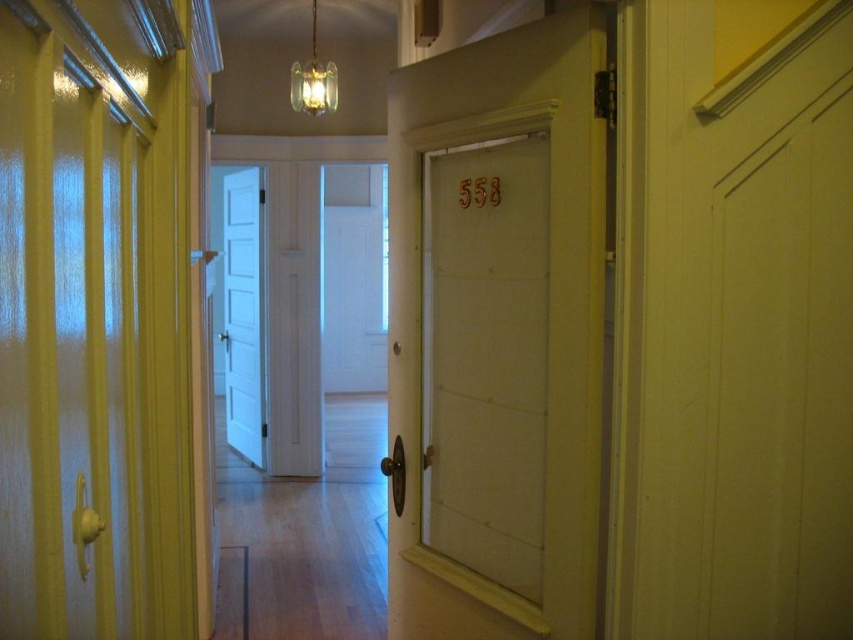
From the picture: Does white wooden door at center have a larger size compared to white painted wood door at center?

Actually, white wooden door at center might be smaller than white painted wood door at center.

Is white wooden door at center shorter than white painted wood door at center?

Yes.

This screenshot has width=853, height=640. In order to click on white wooden door at center in this screenshot , I will do `click(486, 356)`.